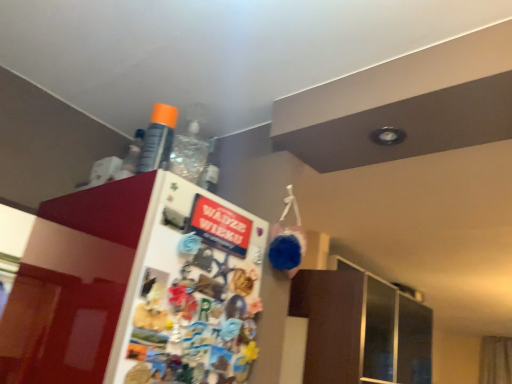
Question: Visually, is white glossy fridge at upper left positioned to the left or to the right of orange matte spray can at upper center?

Choices:
 (A) left
 (B) right

Answer: (B)

Question: In terms of height, does white glossy fridge at upper left look taller or shorter compared to orange matte spray can at upper center?

Choices:
 (A) short
 (B) tall

Answer: (B)

Question: Choose the correct answer: Is white glossy fridge at upper left inside orange matte spray can at upper center or outside it?

Choices:
 (A) outside
 (B) inside

Answer: (A)

Question: Is point (157, 165) positioned closer to the camera than point (209, 221)?

Choices:
 (A) farther
 (B) closer

Answer: (A)

Question: Do you think orange matte spray can at upper center is within white glossy fridge at upper left, or outside of it?

Choices:
 (A) inside
 (B) outside

Answer: (B)

Question: Visually, is orange matte spray can at upper center positioned to the left or to the right of white glossy fridge at upper left?

Choices:
 (A) left
 (B) right

Answer: (A)

Question: Is orange matte spray can at upper center taller or shorter than white glossy fridge at upper left?

Choices:
 (A) tall
 (B) short

Answer: (B)